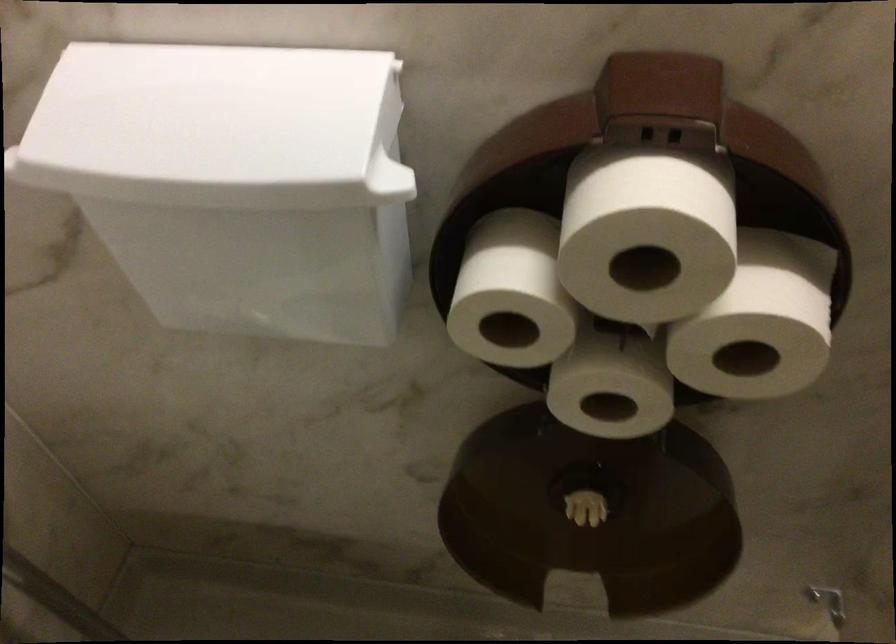
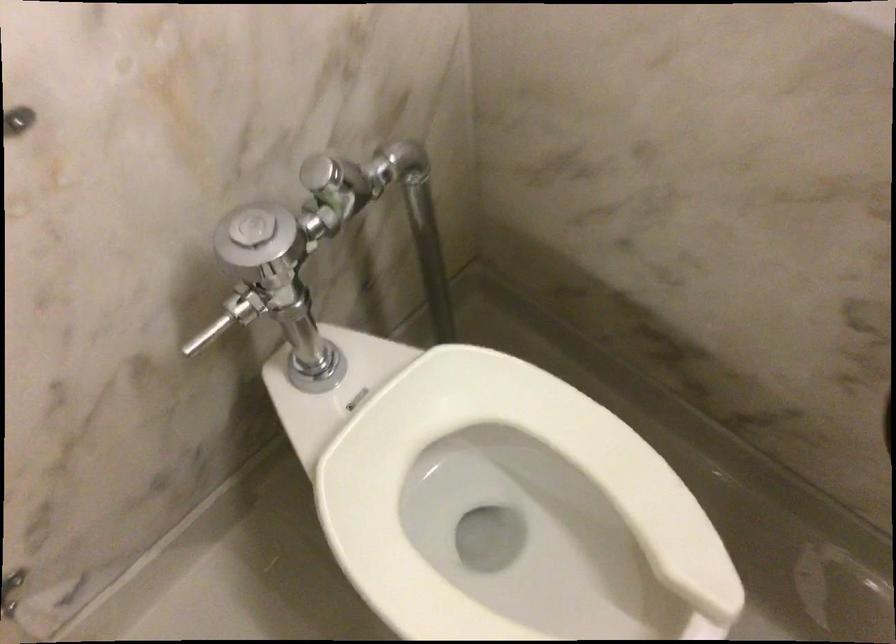
Question: Based on the continuous images, in which direction is the camera rotating? Reply with the corresponding letter.

Choices:
 (A) Left
 (B) Right
 (C) Up
 (D) Down

Answer: (A)